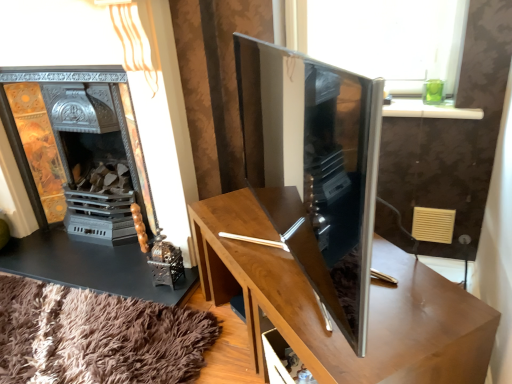
At what (x,y) coordinates should I click in order to perform the action: click on free point below satin wood tv cabinet at center (from a real-world perspective). Please return your answer as a coordinate pair (x, y). Looking at the image, I should click on (265, 255).